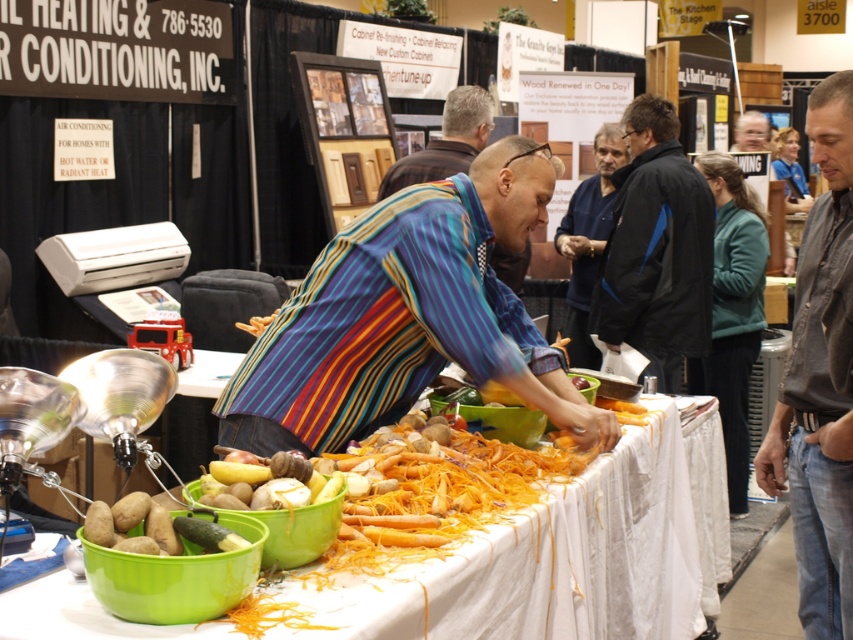
What is located at the point with coordinates (567, 554) in the image?

The point at coordinates (567, 554) indicates orange shredded carrots at center.

You are a photographer at the exhibition and want to capture a clear photo of both the striped fabric shirt at center and the black jacket at center. Considering their positions, which one might block the other in the frame?

The striped fabric shirt at center might block the black jacket at center because it is wider than the black jacket at center.